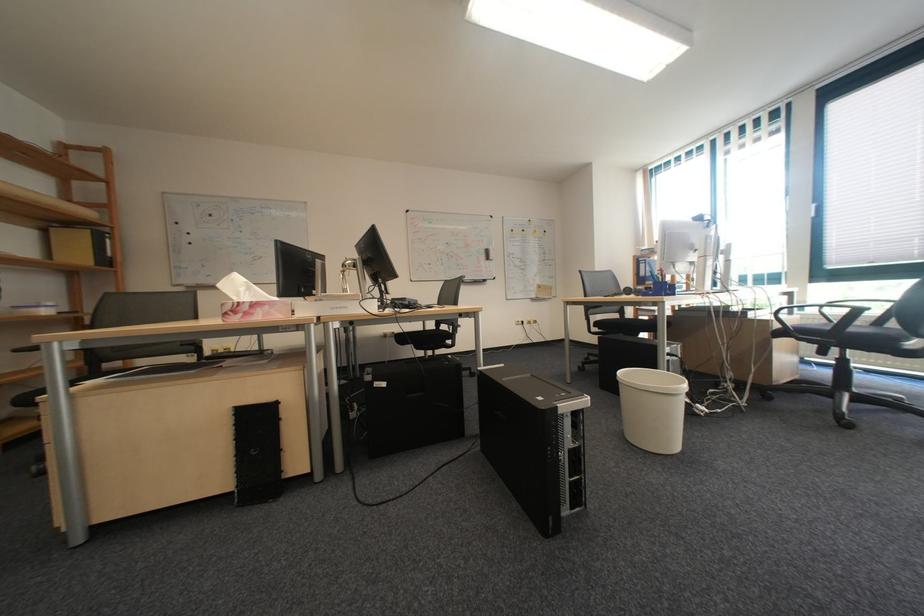
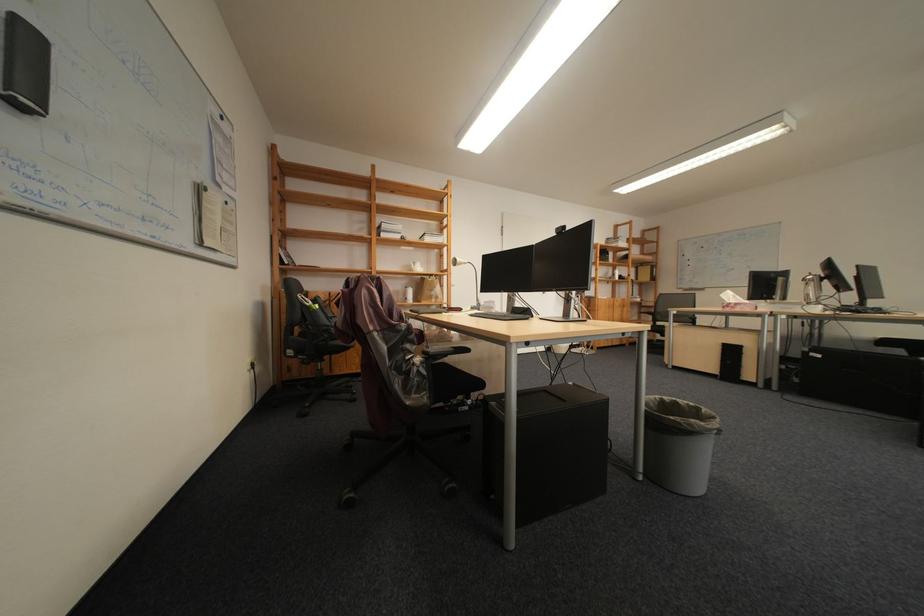
Find the pixel in the second image that matches point (358, 267) in the first image.

(819, 282)